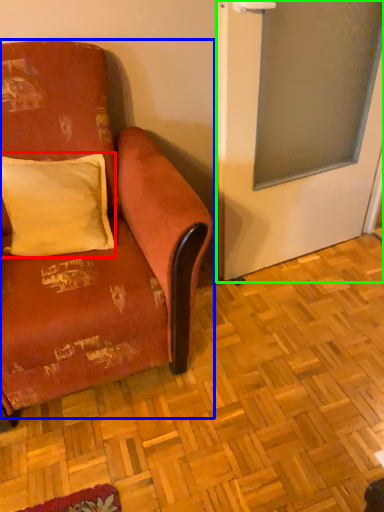
Question: Estimate the real-world distances between objects in this image. Which object is farther from pillow (highlighted by a red box), studio couch (highlighted by a blue box) or screen door (highlighted by a green box)?

Choices:
 (A) studio couch
 (B) screen door

Answer: (B)